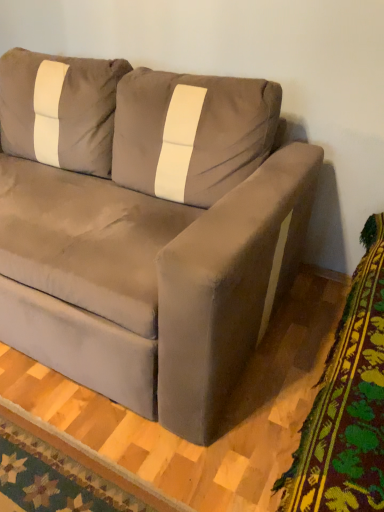
This screenshot has height=512, width=384. What are the coordinates of `suede gray couch at center` in the screenshot? It's located at (145, 228).

Describe the element at coordinates (145, 228) in the screenshot. The height and width of the screenshot is (512, 384). I see `suede gray couch at center` at that location.

The image size is (384, 512). What are the coordinates of `suede gray couch at center` in the screenshot? It's located at (145, 228).